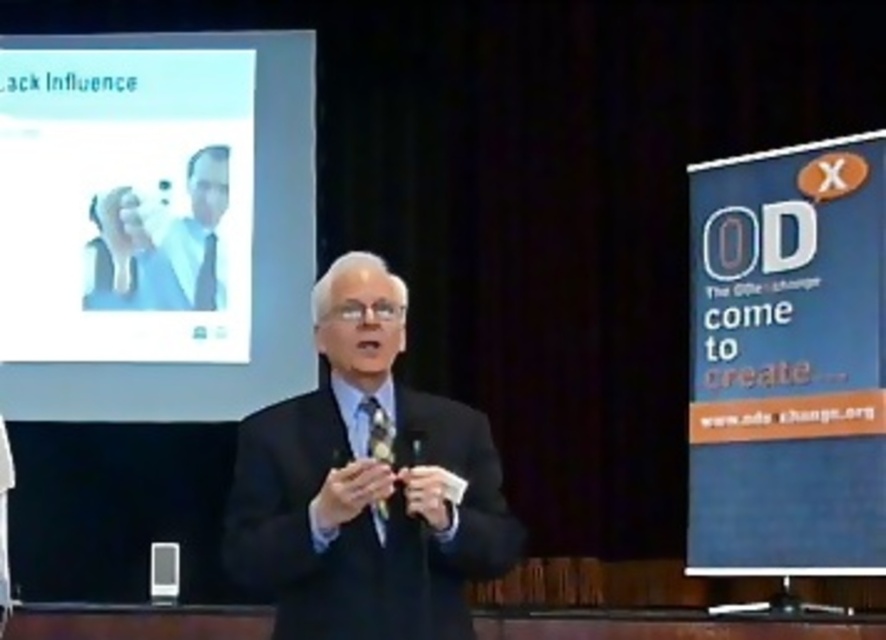
Question: Which object is farther from the camera taking this photo?

Choices:
 (A) white glossy projector screen at upper left
 (B) matte black suit at center
 (C) shiny black tie at center
 (D) matte black tie at center

Answer: (D)

Question: Which point is closer to the camera?

Choices:
 (A) (211, 284)
 (B) (702, 198)

Answer: (B)

Question: Is blue paper at right above matte black tie at center?

Choices:
 (A) yes
 (B) no

Answer: (B)

Question: Is light blue suit at upper left bigger than shiny black tie at center?

Choices:
 (A) no
 (B) yes

Answer: (B)

Question: Does white glossy projector screen at upper left appear under light blue suit at upper left?

Choices:
 (A) yes
 (B) no

Answer: (B)

Question: Which point appears closest to the camera in this image?

Choices:
 (A) (215, 241)
 (B) (263, 100)
 (C) (787, 502)

Answer: (C)